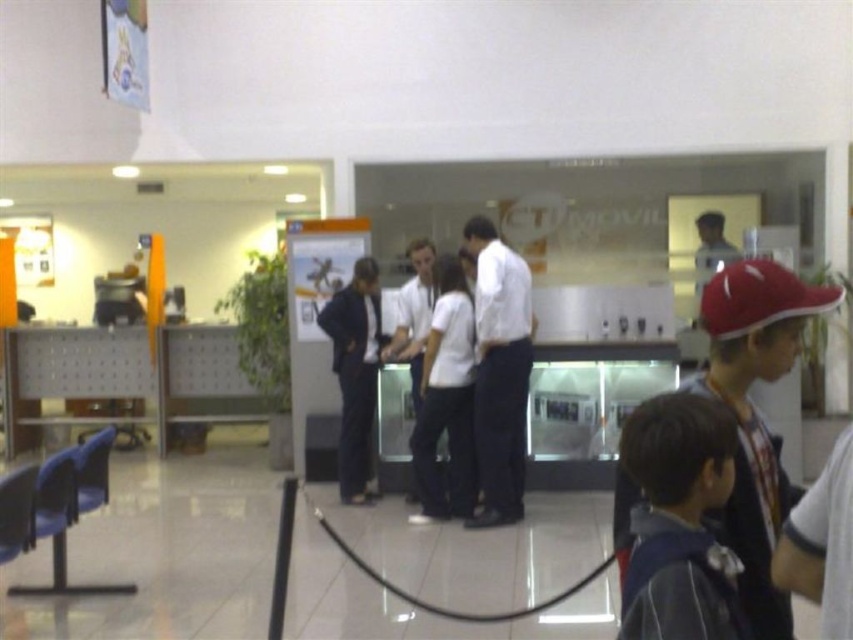
Between point (448, 483) and point (343, 429), which one is positioned in front?

Point (448, 483) is in front.

Who is higher up, white cotton shirt at center or dark blue suit at center?

dark blue suit at center

Identify the location of white cotton shirt at center. The width and height of the screenshot is (853, 640). (445, 400).

The height and width of the screenshot is (640, 853). What are the coordinates of `white cotton shirt at center` in the screenshot? It's located at (445, 400).

Does white shirt at center have a lesser height compared to white cotton shirt at center?

No.

In the scene shown: Which of these two, white shirt at center or white cotton shirt at center, stands taller?

Standing taller between the two is white shirt at center.

Between point (485, 390) and point (445, 518), which one is positioned behind?

Positioned behind is point (445, 518).

Locate an element on the screen. This screenshot has width=853, height=640. white shirt at center is located at coordinates (498, 371).

Consider the image. Who is taller, white shirt at center or dark blue suit at center?

Standing taller between the two is white shirt at center.

Between point (482, 385) and point (369, 260), which one is positioned behind?

The point (369, 260) is behind.

This screenshot has height=640, width=853. Find the location of `white shirt at center`. white shirt at center is located at coordinates (498, 371).